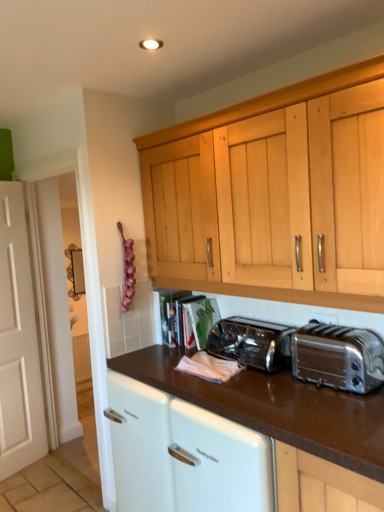
Find the location of a particular element. The width and height of the screenshot is (384, 512). free space in front of silver metallic toaster at right, the second toaster positioned from the back is located at coordinates (345, 413).